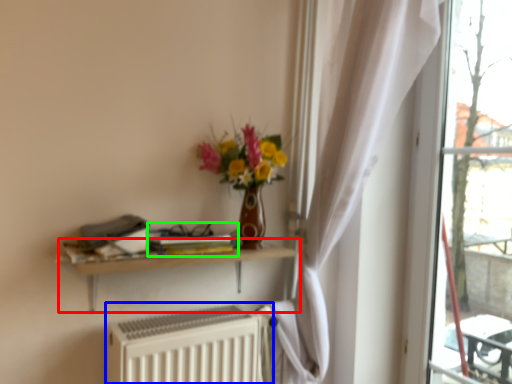
Question: Considering the real-world distances, which object is closest to shelf (highlighted by a red box)? radiator (highlighted by a blue box) or book (highlighted by a green box).

Choices:
 (A) radiator
 (B) book

Answer: (B)